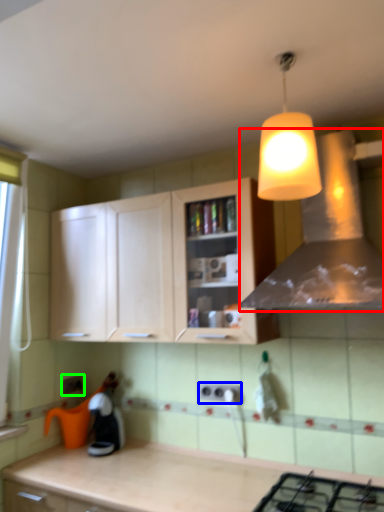
Question: Which object is positioned closest to vent (highlighted by a red box)? Select from electric outlet (highlighted by a blue box) and electric outlet (highlighted by a green box).

Choices:
 (A) electric outlet
 (B) electric outlet

Answer: (A)